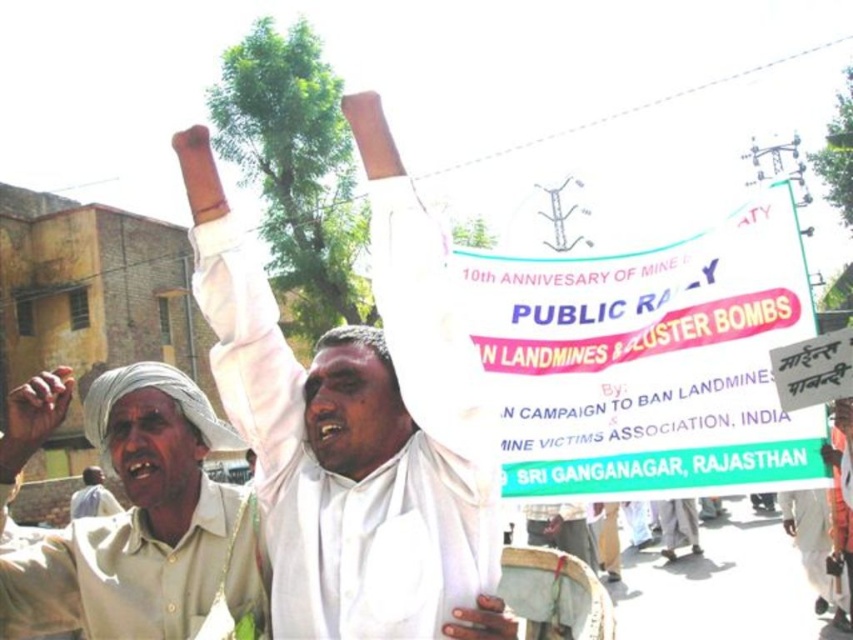
You are a photographer at the rally and want to capture both the beige cotton shirt at upper left and the light beige fabric turban at lower left in the same frame. Which object should you focus on first to ensure both are in the frame?

The beige cotton shirt at upper left is taller than the light beige fabric turban at lower left. Since the shirt is taller, you should focus on the beige cotton shirt at upper left first to ensure both are in the frame.

You are a photographer at the rally and want to capture both the white cloth at center and the beige cotton shirt at upper left in a single frame. Based on their positions, which object should you focus on first to ensure both are in the shot?

The white cloth at center is to the right of the beige cotton shirt at upper left, so focusing on the beige cotton shirt at upper left first would allow you to frame the shot to include both objects since it is positioned to the left.

You are a photographer at the rally and want to capture both the white cloth at center and the light beige fabric turban at lower left in a single frame. Based on their sizes, which object should you focus on to ensure both are visible without cropping?

The white cloth at center is taller than the light beige fabric turban at lower left. To capture both without cropping, focus on the white cloth at center since it is larger and can be positioned centrally while the smaller turban remains within the frame.